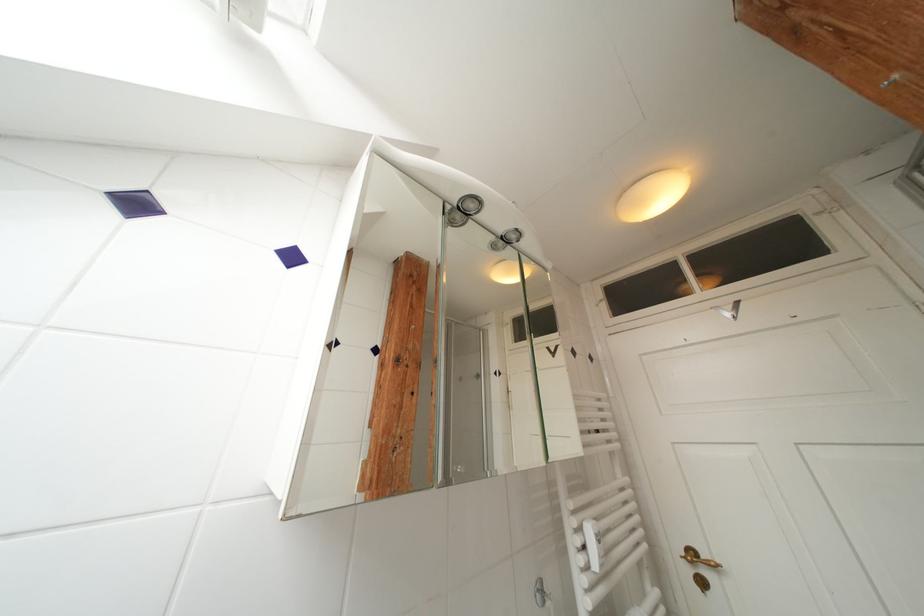
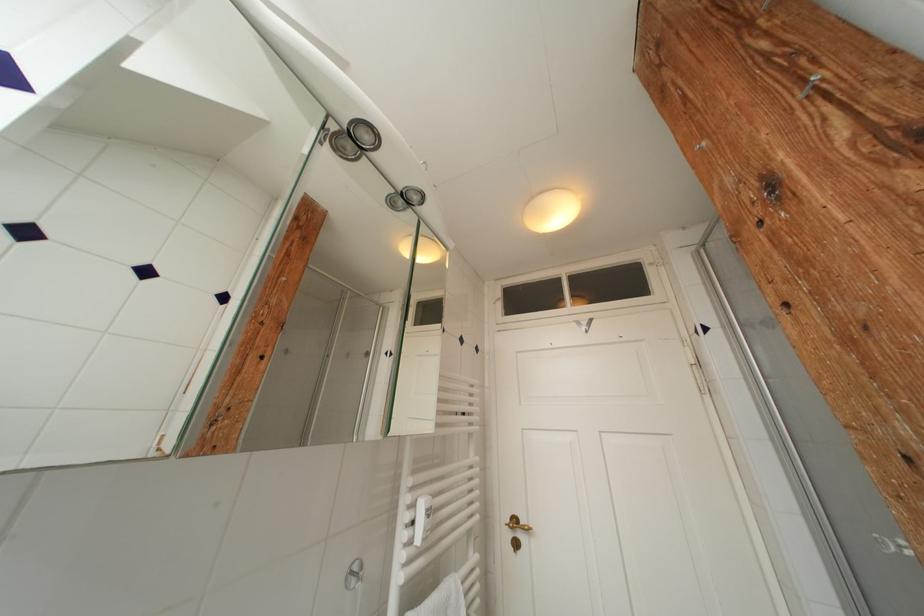
In the second image, find the point that corresponds to [696,573] in the first image.

(516, 539)